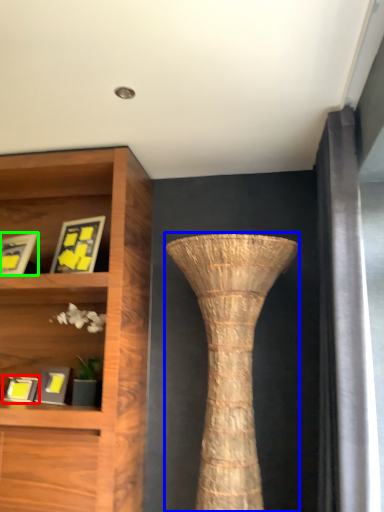
Question: Which object is positioned farthest from picture frame (highlighted by a red box)? Select from vase (highlighted by a blue box) and picture frame (highlighted by a green box).

Choices:
 (A) vase
 (B) picture frame

Answer: (A)